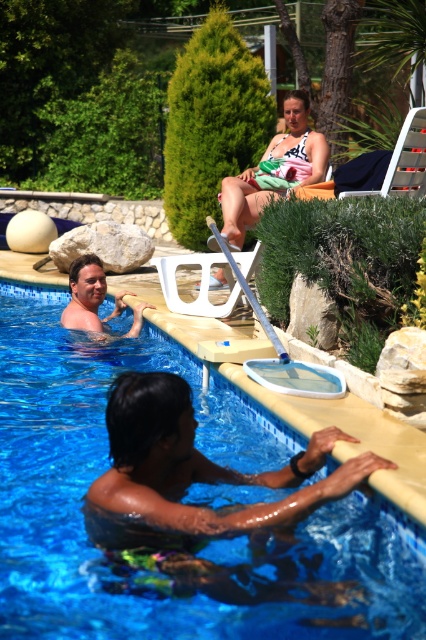
You are a photographer trying to capture a closeup shot of the matte pink bikini top at upper center and the smooth skin man at left. Since you want to focus on the bikini top, which object should you move closer to the camera?

The matte pink bikini top at upper center is wider than the smooth skin man at left, so to focus on it, you should move the matte pink bikini top at upper center closer to the camera.

From the picture: You are standing on the pool deck and want to hand a towel to the smooth skin man at left without getting too wet. Since the blue glossy swimming pool at center is in the way, which direction should you move to so you can reach him?

The blue glossy swimming pool at center is to the right of the smooth skin man at left, so you should move to the left side of the pool to reach him without obstruction.